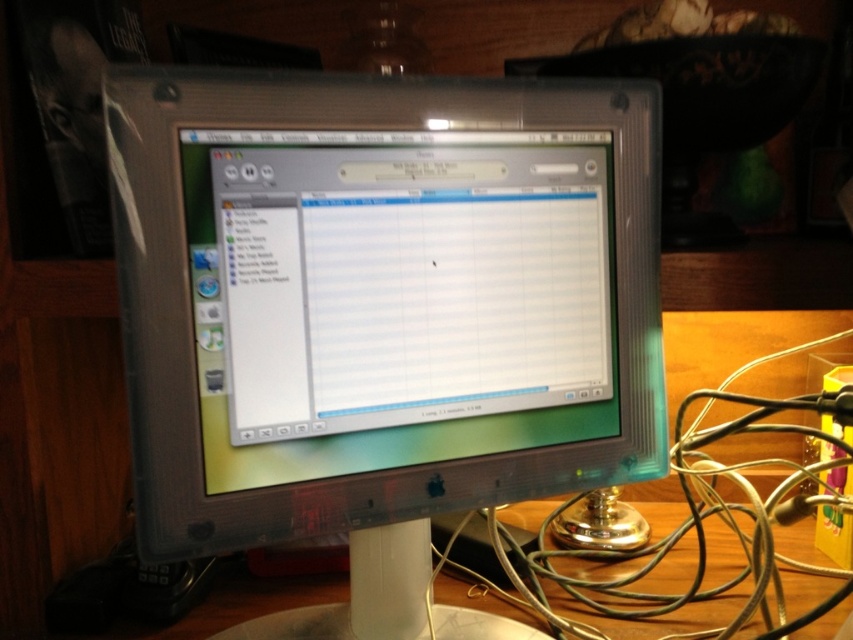
You are setting up a new cable connection between the clear plastic monitor at center and the green metallic wire at right. The cable you have is 7 inches long. Will the cable be long enough to reach between them?

The distance between the clear plastic monitor at center and the green metallic wire at right is 7.89 inches. Since the cable is only 7 inches long, it is shorter than the required distance. Therefore, the cable will not be long enough to reach between them.

You are standing in front of a vintage CRT computer monitor on a wooden desk. You notice a point marked at coordinates (378, 310). Based on the scene, what object does this point correspond to?

The point at coordinates (378, 310) corresponds to the clear plastic monitor at center.

You are standing in front of the vintage CRT computer monitor and want to touch both points on the screen. Which point, point (645, 328) or point (827, 413), will you reach first?

Point (645, 328) is closer to the viewer than point (827, 413), so you will reach point (645, 328) first.